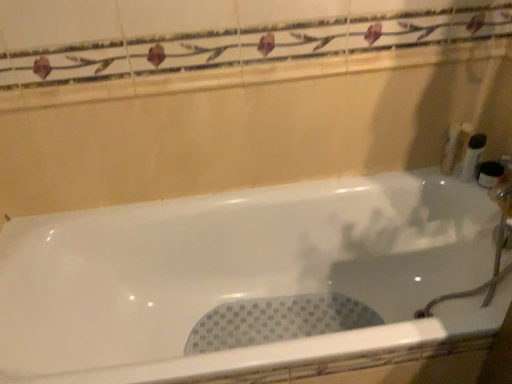
The image size is (512, 384). Identify the location of vacant space that is to the left of white plastic bottle at right, the fourth toiletry from the right. (413, 176).